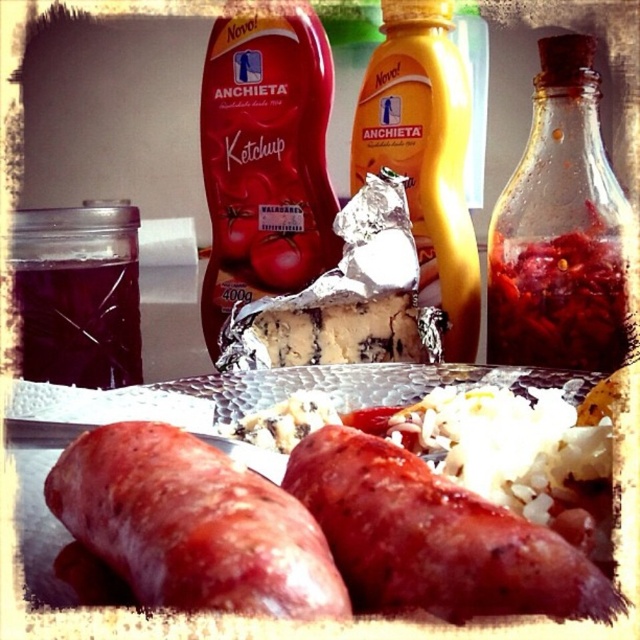
Question: Does red glossy sausage at lower left appear under translucent glass jar at upper right?

Choices:
 (A) yes
 (B) no

Answer: (A)

Question: From the image, what is the correct spatial relationship of red glossy sausage at lower left in relation to red glossy sausage at center?

Choices:
 (A) below
 (B) above

Answer: (B)

Question: Which is farther from the translucent glass jar at upper right?

Choices:
 (A) red glossy sausage at center
 (B) yellow matte bottle at center
 (C) red glossy sausage at lower left

Answer: (C)

Question: Which point is closer to the camera?

Choices:
 (A) red glossy sausage at lower left
 (B) red glossy sausage at center
 (C) yellow matte bottle at center
 (D) translucent glass jar at upper right

Answer: (A)

Question: Does red glossy sausage at lower left appear under red glossy sausage at center?

Choices:
 (A) yes
 (B) no

Answer: (B)

Question: Among these objects, which one is nearest to the camera?

Choices:
 (A) yellow matte bottle at center
 (B) red glossy sausage at center

Answer: (B)